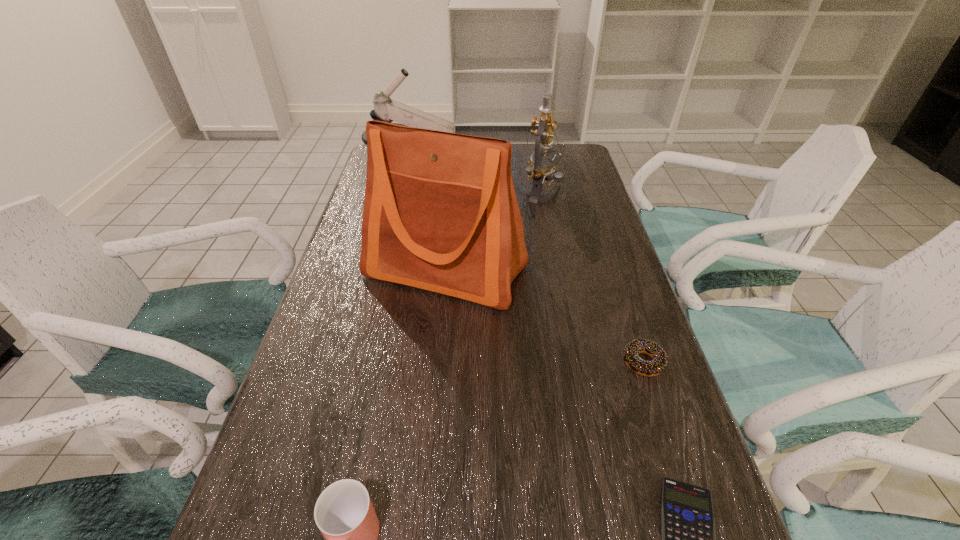
The image size is (960, 540). I want to click on free spot that satisfies the following two spatial constraints: 1. at the eyepiece of the left microscope; 2. on the left side of the fourth nearest object, so click(x=396, y=271).

At what (x,y) coordinates should I click in order to perform the action: click on free region that satisfies the following two spatial constraints: 1. on the back side of the fifth tallest object; 2. at the eyepiece of the left microscope. Please return your answer as a coordinate pair (x, y). Looking at the image, I should click on pyautogui.click(x=583, y=182).

This screenshot has height=540, width=960. Find the location of `vacant space that satisfies the following two spatial constraints: 1. at the eyepiece of the second shortest object; 2. on the left side of the left microscope`. vacant space that satisfies the following two spatial constraints: 1. at the eyepiece of the second shortest object; 2. on the left side of the left microscope is located at coordinates (375, 362).